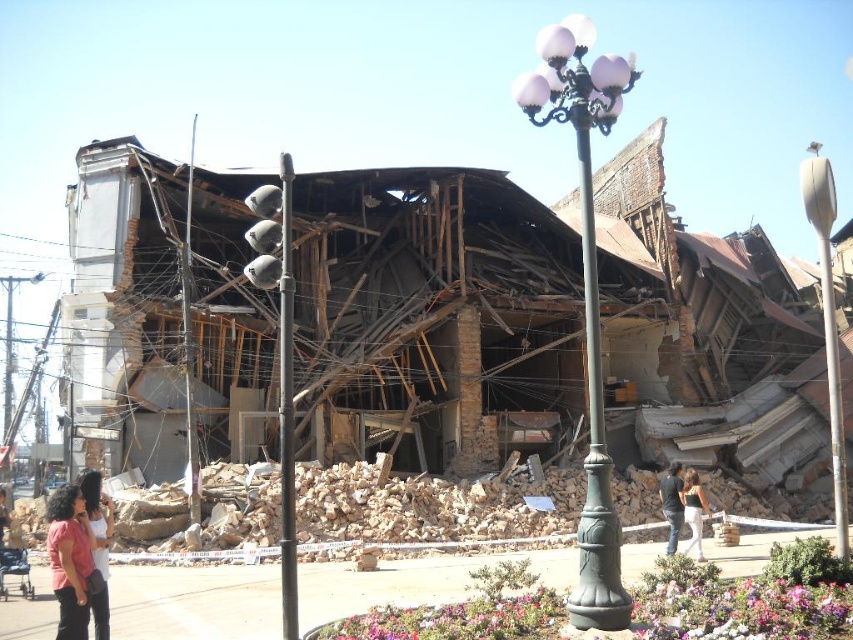
You are a rescue worker assessing the damage. You see the green metal pole at center and the green cast iron streetlight at center. Which one is taller?

The green metal pole at center is much taller than the green cast iron streetlight at center.

You are a rescue worker trying to locate a missing person in the disaster area shown. You have a map with coordinates. Where would you look for the matte pink shirt at lower left?

The matte pink shirt at lower left is located at coordinates point (71,561).

You are a drone operator trying to assess the damage from above. You notice two points marked in the image. Which point, point 1 at coordinates point (57, 508) or point 2 at coordinates point (102, 493), is closer to your drone camera?

Point (57, 508) is closer to the camera than point (102, 493).